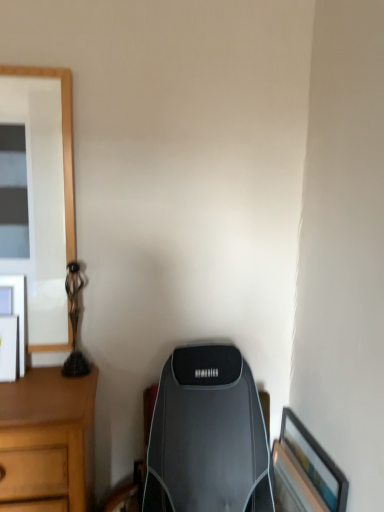
What do you see at coordinates (305, 471) in the screenshot? Image resolution: width=384 pixels, height=512 pixels. I see `wooden framed picture at lower right, which is counted as the 1th picture frame, starting from the right` at bounding box center [305, 471].

Where is `bronze/statue at left`? Image resolution: width=384 pixels, height=512 pixels. bronze/statue at left is located at coordinates (74, 323).

From the image's perspective, is bronze/statue at left above or below matte black picture frame at left, which is the 2th picture frame in bottom-to-top order?

From the image's perspective, bronze/statue at left appears above matte black picture frame at left, which is the 2th picture frame in bottom-to-top order.

Which is in front, point (78, 351) or point (25, 327)?

The point (25, 327) is closer to the camera.

Could you tell me if bronze/statue at left is facing matte black picture frame at left, which is the 2th picture frame in bottom-to-top order?

No, bronze/statue at left does not turn towards matte black picture frame at left, which is the 2th picture frame in bottom-to-top order.

Between bronze/statue at left and matte black picture frame at left, which is the 2th picture frame from right to left, which one has larger size?

With larger size is bronze/statue at left.

Is wooden framed picture at lower right, which is the 2th picture frame in left-to-right order, bigger or smaller than bronze/statue at left?

In the image, wooden framed picture at lower right, which is the 2th picture frame in left-to-right order, appears to be larger than bronze/statue at left.

Which is in front, point (294, 485) or point (69, 275)?

The point (69, 275) is more forward.

Are wooden framed picture at lower right, which is the 2th picture frame in left-to-right order, and bronze/statue at left beside each other?

They are not placed beside each other.

Is wooden framed picture at lower right, which is the 2th picture frame in left-to-right order, in front of bronze/statue at left?

Yes, wooden framed picture at lower right, which is the 2th picture frame in left-to-right order, is closer to the viewer.

From the image's perspective, would you say bronze/statue at left is positioned over wooden framed picture at lower right, which is counted as the 1th picture frame, starting from the right?

Yes, from the image's perspective, bronze/statue at left is above wooden framed picture at lower right, which is counted as the 1th picture frame, starting from the right.

From a real-world perspective, is bronze/statue at left physically above wooden framed picture at lower right, the 1th picture frame in the bottom-to-top sequence?

Indeed, from a real-world perspective, bronze/statue at left stands above wooden framed picture at lower right, the 1th picture frame in the bottom-to-top sequence.

Between bronze/statue at left and wooden framed picture at lower right, marked as the second picture frame in a top-to-bottom arrangement, which one has larger width?

With larger width is wooden framed picture at lower right, marked as the second picture frame in a top-to-bottom arrangement.

From a real-world perspective, is matte black picture frame at left, which is the 2th picture frame from right to left, positioned over wooden framed picture at lower right, which is counted as the 1th picture frame, starting from the right, based on gravity?

Yes, from a real-world perspective, matte black picture frame at left, which is the 2th picture frame from right to left, is on top of wooden framed picture at lower right, which is counted as the 1th picture frame, starting from the right.

Which object is positioned more to the left, matte black picture frame at left, which is the 2th picture frame from right to left, or wooden framed picture at lower right, marked as the second picture frame in a top-to-bottom arrangement?

From the viewer's perspective, matte black picture frame at left, which is the 2th picture frame from right to left, appears more on the left side.

Does matte black picture frame at left, the 1th picture frame viewed from the left, turn towards wooden framed picture at lower right, the 1th picture frame in the bottom-to-top sequence?

No, matte black picture frame at left, the 1th picture frame viewed from the left, does not turn towards wooden framed picture at lower right, the 1th picture frame in the bottom-to-top sequence.

Between point (23, 364) and point (338, 477), which one is positioned in front?

Point (338, 477)

In the scene shown: How different are the orientations of wooden framed picture at lower right, marked as the second picture frame in a top-to-bottom arrangement, and matte black picture frame at left, which is the 2th picture frame from right to left, in degrees?

They differ by 179 degrees in their facing directions.

Is wooden framed picture at lower right, the 1th picture frame in the bottom-to-top sequence, located outside matte black picture frame at left, the 1th picture frame viewed from the left?

That's correct, wooden framed picture at lower right, the 1th picture frame in the bottom-to-top sequence, is outside of matte black picture frame at left, the 1th picture frame viewed from the left.

Which of these two, wooden framed picture at lower right, the 1th picture frame in the bottom-to-top sequence, or matte black picture frame at left, the 1th picture frame viewed from the left, is smaller?

matte black picture frame at left, the 1th picture frame viewed from the left, is smaller.

Where is `picture frame that appears behind the wooden framed picture at lower right, the 1th picture frame in the bottom-to-top sequence`? The image size is (384, 512). picture frame that appears behind the wooden framed picture at lower right, the 1th picture frame in the bottom-to-top sequence is located at coordinates (18, 312).

Would you say bronze/statue at left is part of matte black picture frame at left, the 1th picture frame viewed from the top,'s contents?

That's incorrect, bronze/statue at left is not inside matte black picture frame at left, the 1th picture frame viewed from the top.

Between matte black picture frame at left, the 1th picture frame viewed from the top, and bronze/statue at left, which one is positioned behind?

Positioned behind is bronze/statue at left.

Considering the sizes of objects matte black picture frame at left, the 1th picture frame viewed from the top, and bronze/statue at left in the image provided, who is taller, matte black picture frame at left, the 1th picture frame viewed from the top, or bronze/statue at left?

Standing taller between the two is bronze/statue at left.

Identify the location of picture frame lying on the left of bronze/statue at left. This screenshot has width=384, height=512. (18, 312).

You are a GUI agent. You are given a task and a screenshot of the screen. Output one action in this format:
    pyautogui.click(x=<x>, y=<y>)
    Task: Click on the table lamp above the wooden framed picture at lower right, which is counted as the 1th picture frame, starting from the right (from the image's perspective)
    Image resolution: width=384 pixels, height=512 pixels.
    Given the screenshot: What is the action you would take?
    pyautogui.click(x=74, y=323)

Considering their positions, is wooden framed picture at lower right, marked as the second picture frame in a top-to-bottom arrangement, positioned closer to matte black picture frame at left, which is the 2th picture frame in bottom-to-top order, than bronze/statue at left?

bronze/statue at left is closer to matte black picture frame at left, which is the 2th picture frame in bottom-to-top order.

From the image, which object appears to be farther from bronze/statue at left, matte black picture frame at left, the 1th picture frame viewed from the top, or wooden framed picture at lower right, which is the 2th picture frame in left-to-right order?

wooden framed picture at lower right, which is the 2th picture frame in left-to-right order, is positioned further to the anchor bronze/statue at left.

Considering their positions, is bronze/statue at left positioned closer to matte black picture frame at left, the 1th picture frame viewed from the left, than wooden framed picture at lower right, marked as the second picture frame in a top-to-bottom arrangement?

bronze/statue at left is positioned closer to the anchor matte black picture frame at left, the 1th picture frame viewed from the left.

Looking at the image, which one is located closer to bronze/statue at left, wooden framed picture at lower right, which is counted as the 1th picture frame, starting from the right, or matte black picture frame at left, the 1th picture frame viewed from the top?

matte black picture frame at left, the 1th picture frame viewed from the top, lies closer to bronze/statue at left than the other object.

From the picture: Considering their positions, is matte black picture frame at left, which is the 2th picture frame in bottom-to-top order, positioned further to wooden framed picture at lower right, which is the 2th picture frame in left-to-right order, than bronze/statue at left?

The object further to wooden framed picture at lower right, which is the 2th picture frame in left-to-right order, is matte black picture frame at left, which is the 2th picture frame in bottom-to-top order.

Which object lies further to the anchor point wooden framed picture at lower right, which is counted as the 1th picture frame, starting from the right, bronze/statue at left or matte black picture frame at left, which is the 2th picture frame from right to left?

Among the two, matte black picture frame at left, which is the 2th picture frame from right to left, is located further to wooden framed picture at lower right, which is counted as the 1th picture frame, starting from the right.

Locate an element on the screen. This screenshot has height=512, width=384. table lamp between matte black picture frame at left, which is the 2th picture frame from right to left, and wooden framed picture at lower right, which is counted as the 1th picture frame, starting from the right, from left to right is located at coordinates (74, 323).